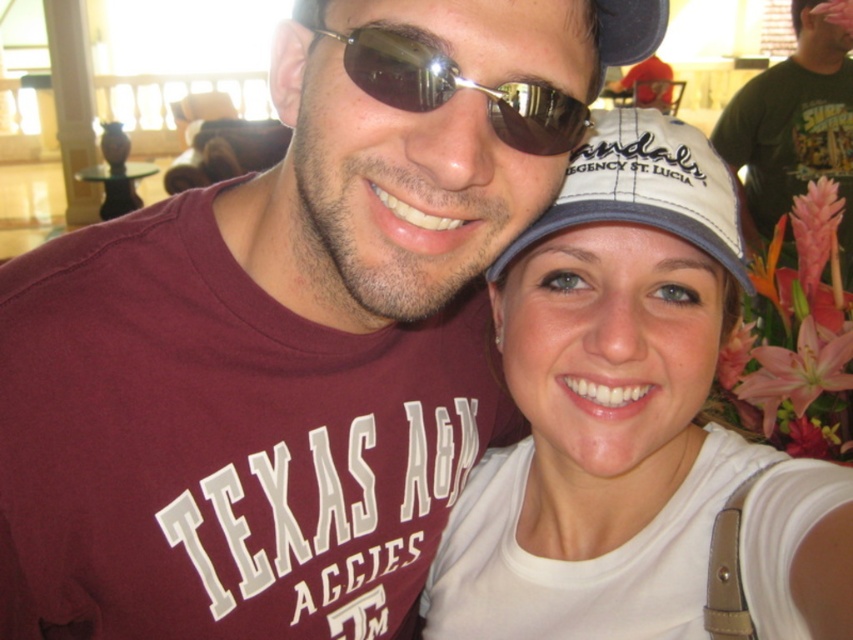
From the picture: Is white fabric baseball cap at center below sunglasses at center?

Yes, white fabric baseball cap at center is below sunglasses at center.

Which is above, white fabric baseball cap at center or sunglasses at center?

sunglasses at center is above.

The image size is (853, 640). Describe the element at coordinates (645, 188) in the screenshot. I see `white fabric baseball cap at center` at that location.

At what (x,y) coordinates should I click in order to perform the action: click on white fabric baseball cap at center. Please return your answer as a coordinate pair (x, y). The width and height of the screenshot is (853, 640). Looking at the image, I should click on (645, 188).

Is sunglasses at center taller than black fabric cap at upper center?

Yes, sunglasses at center is taller than black fabric cap at upper center.

Who is more forward, (543,136) or (650,12)?

Positioned in front is point (543,136).

Find the location of a particular element. This screenshot has height=640, width=853. sunglasses at center is located at coordinates (457, 88).

Is point (630, 284) farther from camera compared to point (363, 49)?

That is True.

The image size is (853, 640). I want to click on white matte cap at upper right, so click(633, 426).

The image size is (853, 640). In order to click on white matte cap at upper right in this screenshot , I will do `click(633, 426)`.